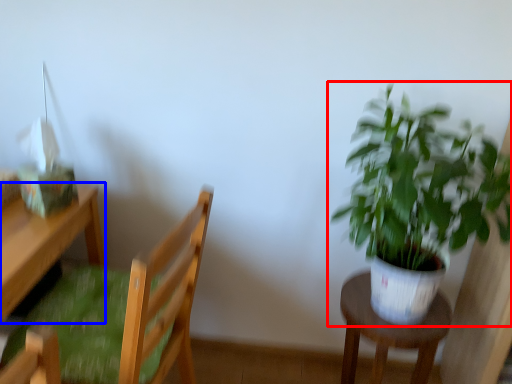
Question: Among these objects, which one is farthest to the camera, houseplant (highlighted by a red box) or desk (highlighted by a blue box)?

Choices:
 (A) houseplant
 (B) desk

Answer: (B)